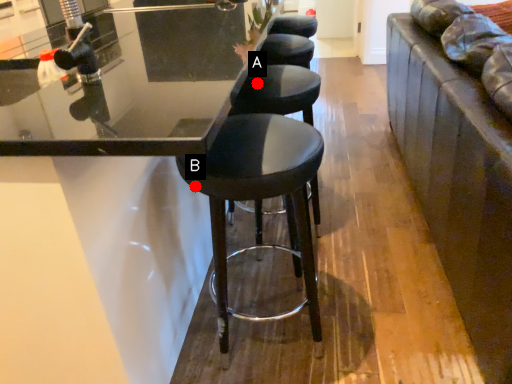
Question: Two points are circled on the image, labeled by A and B beside each circle. Which point appears closest to the camera in this image?

Choices:
 (A) A is closer
 (B) B is closer

Answer: (B)